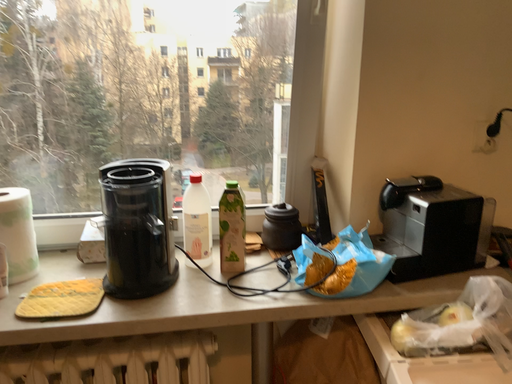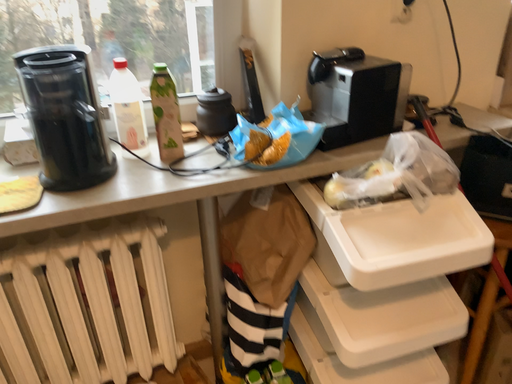
Question: Which way did the camera rotate in the video?

Choices:
 (A) rotated downward
 (B) rotated upward

Answer: (A)